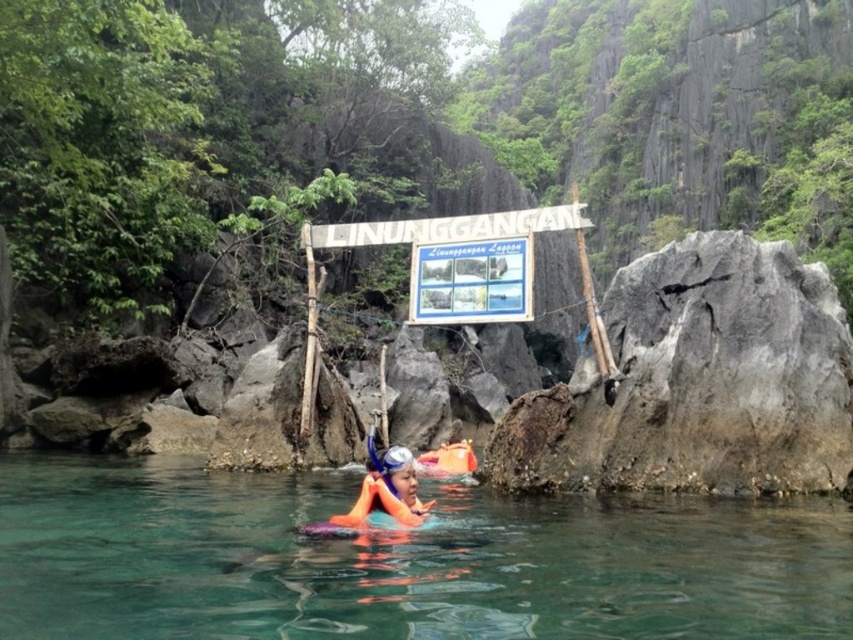
Is clear water at center behind white plastic sign at center?

No, it is in front of white plastic sign at center.

Between point (131, 625) and point (514, 296), which one is positioned in front?

Point (131, 625)

Locate an element on the screen. clear water at center is located at coordinates (399, 561).

Can you confirm if gray rough rock at right is smaller than orange life jacket at center?

No, gray rough rock at right is not smaller than orange life jacket at center.

Consider the image. Is gray rough rock at right to the right of orange life jacket at center from the viewer's perspective?

Indeed, gray rough rock at right is positioned on the right side of orange life jacket at center.

At what (x,y) coordinates should I click in order to perform the action: click on gray rough rock at right. Please return your answer as a coordinate pair (x, y). This screenshot has height=640, width=853. Looking at the image, I should click on (697, 381).

Can you confirm if white plastic sign at center is positioned above orange life jacket at center?

Yes, white plastic sign at center is above orange life jacket at center.

Between point (531, 268) and point (372, 481), which one is positioned in front?

Point (372, 481) is more forward.

Describe the element at coordinates (471, 282) in the screenshot. The height and width of the screenshot is (640, 853). I see `white plastic sign at center` at that location.

Where is `white plastic sign at center`? The height and width of the screenshot is (640, 853). white plastic sign at center is located at coordinates (471, 282).